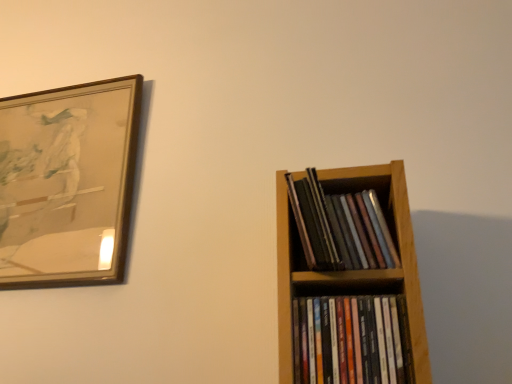
What do you see at coordinates (351, 340) in the screenshot? I see `multicolored glossy cd cases at right, the second book in the top-to-bottom sequence` at bounding box center [351, 340].

This screenshot has width=512, height=384. Identify the location of wooden picture frame at upper left. (67, 182).

The image size is (512, 384). Describe the element at coordinates (340, 227) in the screenshot. I see `matte black books at right, marked as the 2th book in a bottom-to-top arrangement` at that location.

Locate an element on the screen. This screenshot has height=384, width=512. multicolored glossy cd cases at right, the second book in the top-to-bottom sequence is located at coordinates [351, 340].

Based on the photo, considering their positions, is wooden picture frame at upper left located in front of or behind multicolored glossy cd cases at right, the second book in the top-to-bottom sequence?

Visually, wooden picture frame at upper left is located behind multicolored glossy cd cases at right, the second book in the top-to-bottom sequence.

Is wooden picture frame at upper left not within multicolored glossy cd cases at right, the second book in the top-to-bottom sequence?

Yes, wooden picture frame at upper left is not within multicolored glossy cd cases at right, the second book in the top-to-bottom sequence.

Is wooden picture frame at upper left bigger than multicolored glossy cd cases at right, which appears as the first book when ordered from the bottom?

Yes, wooden picture frame at upper left is bigger than multicolored glossy cd cases at right, which appears as the first book when ordered from the bottom.

Looking at this image, from a real-world perspective, is wooden picture frame at upper left physically located above or below multicolored glossy cd cases at right, which appears as the first book when ordered from the bottom?

wooden picture frame at upper left is above multicolored glossy cd cases at right, which appears as the first book when ordered from the bottom.

In terms of height, does wooden picture frame at upper left look taller or shorter compared to matte black books at right, which ranks as the first book in top-to-bottom order?

Considering their sizes, wooden picture frame at upper left has more height than matte black books at right, which ranks as the first book in top-to-bottom order.

Considering the sizes of wooden picture frame at upper left and matte black books at right, which ranks as the first book in top-to-bottom order, in the image, is wooden picture frame at upper left bigger or smaller than matte black books at right, which ranks as the first book in top-to-bottom order,?

Considering their sizes, wooden picture frame at upper left takes up more space than matte black books at right, which ranks as the first book in top-to-bottom order.

From the image's perspective, is wooden picture frame at upper left under matte black books at right, marked as the 2th book in a bottom-to-top arrangement?

Incorrect, from the image's perspective, wooden picture frame at upper left is higher than matte black books at right, marked as the 2th book in a bottom-to-top arrangement.

From their relative heights in the image, would you say matte black books at right, marked as the 2th book in a bottom-to-top arrangement, is taller or shorter than wooden picture frame at upper left?

Clearly, matte black books at right, marked as the 2th book in a bottom-to-top arrangement, is shorter compared to wooden picture frame at upper left.

From a real-world perspective, which book is the 1st one underneath the wooden picture frame at upper left? Please provide its 2D coordinates.

[(340, 227)]

Can you tell me how much matte black books at right, which ranks as the first book in top-to-bottom order, and wooden picture frame at upper left differ in facing direction?

The facing directions of matte black books at right, which ranks as the first book in top-to-bottom order, and wooden picture frame at upper left are 2.22 degrees apart.

Is matte black books at right, which ranks as the first book in top-to-bottom order, not close to multicolored glossy cd cases at right, which appears as the first book when ordered from the bottom?

matte black books at right, which ranks as the first book in top-to-bottom order, is near multicolored glossy cd cases at right, which appears as the first book when ordered from the bottom, not far away.

Does matte black books at right, which ranks as the first book in top-to-bottom order, lie behind multicolored glossy cd cases at right, which appears as the first book when ordered from the bottom?

Yes, matte black books at right, which ranks as the first book in top-to-bottom order, is further from the viewer.

From a real-world perspective, is matte black books at right, which ranks as the first book in top-to-bottom order, physically below multicolored glossy cd cases at right, which appears as the first book when ordered from the bottom?

No, from a real-world perspective, matte black books at right, which ranks as the first book in top-to-bottom order, is not beneath multicolored glossy cd cases at right, which appears as the first book when ordered from the bottom.

Would you say matte black books at right, which ranks as the first book in top-to-bottom order, is inside or outside multicolored glossy cd cases at right, the second book in the top-to-bottom sequence?

matte black books at right, which ranks as the first book in top-to-bottom order, is not inside multicolored glossy cd cases at right, the second book in the top-to-bottom sequence, it's outside.

Is multicolored glossy cd cases at right, the second book in the top-to-bottom sequence, touching matte black books at right, which ranks as the first book in top-to-bottom order?

No, multicolored glossy cd cases at right, the second book in the top-to-bottom sequence, is not touching matte black books at right, which ranks as the first book in top-to-bottom order.

What's the angular difference between multicolored glossy cd cases at right, which appears as the first book when ordered from the bottom, and matte black books at right, marked as the 2th book in a bottom-to-top arrangement,'s facing directions?

The angular difference between multicolored glossy cd cases at right, which appears as the first book when ordered from the bottom, and matte black books at right, marked as the 2th book in a bottom-to-top arrangement, is 0.00369 degrees.

Between multicolored glossy cd cases at right, the second book in the top-to-bottom sequence, and matte black books at right, which ranks as the first book in top-to-bottom order, which one has less height?

With less height is multicolored glossy cd cases at right, the second book in the top-to-bottom sequence.

Is multicolored glossy cd cases at right, the second book in the top-to-bottom sequence, oriented away from wooden picture frame at upper left?

That's not correct — multicolored glossy cd cases at right, the second book in the top-to-bottom sequence, is not looking away from wooden picture frame at upper left.

Are multicolored glossy cd cases at right, the second book in the top-to-bottom sequence, and wooden picture frame at upper left far apart?

multicolored glossy cd cases at right, the second book in the top-to-bottom sequence, is actually quite close to wooden picture frame at upper left.

Considering the sizes of objects multicolored glossy cd cases at right, the second book in the top-to-bottom sequence, and wooden picture frame at upper left in the image provided, who is bigger, multicolored glossy cd cases at right, the second book in the top-to-bottom sequence, or wooden picture frame at upper left?

wooden picture frame at upper left is bigger.

From the picture: Which object is closer to the camera taking this photo, multicolored glossy cd cases at right, the second book in the top-to-bottom sequence, or wooden picture frame at upper left?

multicolored glossy cd cases at right, the second book in the top-to-bottom sequence, is closer to the camera.

The width and height of the screenshot is (512, 384). What are the coordinates of `picture frame above the multicolored glossy cd cases at right, which appears as the first book when ordered from the bottom (from the image's perspective)` in the screenshot? It's located at (67, 182).

Find the location of a particular element. This screenshot has height=384, width=512. picture frame behind the matte black books at right, marked as the 2th book in a bottom-to-top arrangement is located at coordinates (67, 182).

Looking at the image, which one is located further to matte black books at right, which ranks as the first book in top-to-bottom order, multicolored glossy cd cases at right, the second book in the top-to-bottom sequence, or wooden picture frame at upper left?

wooden picture frame at upper left lies further to matte black books at right, which ranks as the first book in top-to-bottom order, than the other object.

When comparing their distances from wooden picture frame at upper left, does multicolored glossy cd cases at right, which appears as the first book when ordered from the bottom, or matte black books at right, which ranks as the first book in top-to-bottom order, seem further?

Among the two, multicolored glossy cd cases at right, which appears as the first book when ordered from the bottom, is located further to wooden picture frame at upper left.

In the scene shown: From the image, which object appears to be farther from multicolored glossy cd cases at right, which appears as the first book when ordered from the bottom, matte black books at right, which ranks as the first book in top-to-bottom order, or wooden picture frame at upper left?

Among the two, wooden picture frame at upper left is located further to multicolored glossy cd cases at right, which appears as the first book when ordered from the bottom.

Which object lies nearer to the anchor point multicolored glossy cd cases at right, the second book in the top-to-bottom sequence, wooden picture frame at upper left or matte black books at right, which ranks as the first book in top-to-bottom order?

matte black books at right, which ranks as the first book in top-to-bottom order, is closer to multicolored glossy cd cases at right, the second book in the top-to-bottom sequence.

Based on their spatial positions, is wooden picture frame at upper left or multicolored glossy cd cases at right, the second book in the top-to-bottom sequence, further from matte black books at right, which ranks as the first book in top-to-bottom order?

wooden picture frame at upper left lies further to matte black books at right, which ranks as the first book in top-to-bottom order, than the other object.

Considering their positions, is matte black books at right, which ranks as the first book in top-to-bottom order, positioned closer to wooden picture frame at upper left than multicolored glossy cd cases at right, which appears as the first book when ordered from the bottom?

The object closer to wooden picture frame at upper left is matte black books at right, which ranks as the first book in top-to-bottom order.

Where is `book situated between wooden picture frame at upper left and matte black books at right, marked as the 2th book in a bottom-to-top arrangement, from left to right`? Image resolution: width=512 pixels, height=384 pixels. book situated between wooden picture frame at upper left and matte black books at right, marked as the 2th book in a bottom-to-top arrangement, from left to right is located at coordinates (351, 340).